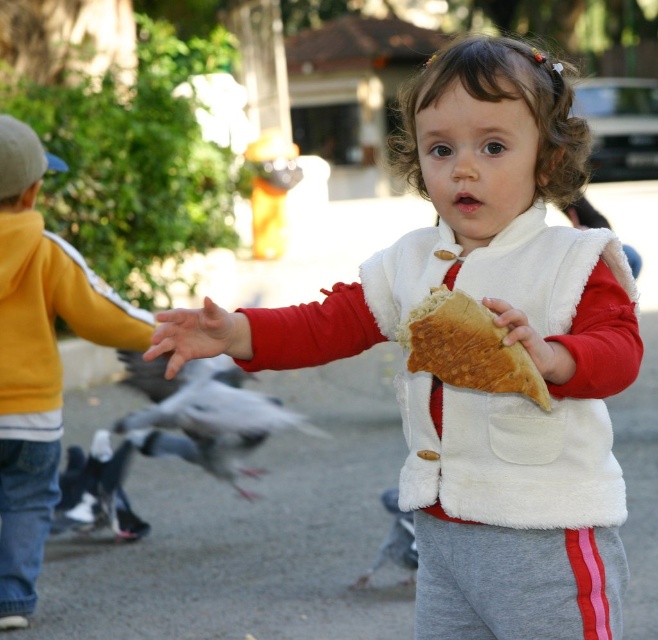
You are a photographer trying to capture the two children in the scene. You notice two points marked at coordinates point (384,346) and point (463,385). Which point is closer to the camera?

Point (384,346) is closer to the camera than point (463,385) because it is further to the camera than the latter.

You are standing in a park and see a gray feathered bird at center. If you want to throw a small pebble to reach the bird, and your throwing range is up to 5 meters, will you be able to hit the bird?

The gray feathered bird at center is 5.52 meters away from you, which exceeds your throwing range of 5 meters. Therefore, you won